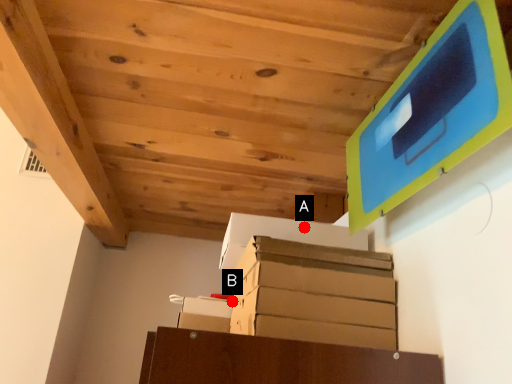
Question: Two points are circled on the image, labeled by A and B beside each circle. Among these points, which one is nearest to the camera?

Choices:
 (A) A is closer
 (B) B is closer

Answer: (A)